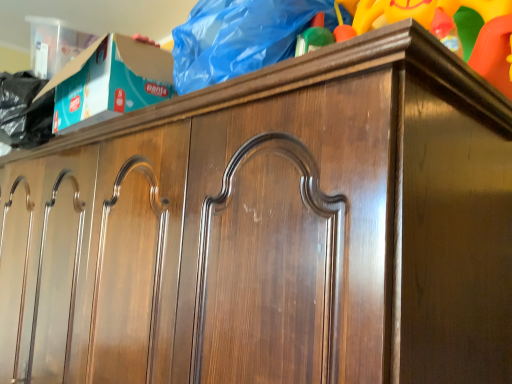
Question: Looking at their shapes, would you say wooden toy at upper right is wider or thinner than wooden cabinet at upper center?

Choices:
 (A) wide
 (B) thin

Answer: (B)

Question: Relative to wooden cabinet at upper center, is wooden toy at upper right in front or behind?

Choices:
 (A) front
 (B) behind

Answer: (A)

Question: From the image's perspective, is wooden toy at upper right located above or below wooden cabinet at upper center?

Choices:
 (A) below
 (B) above

Answer: (B)

Question: From the image's perspective, is wooden cabinet at upper center positioned above or below wooden toy at upper right?

Choices:
 (A) below
 (B) above

Answer: (A)

Question: Is wooden cabinet at upper center bigger or smaller than wooden toy at upper right?

Choices:
 (A) small
 (B) big

Answer: (B)

Question: Visually, is wooden cabinet at upper center positioned to the left or to the right of wooden toy at upper right?

Choices:
 (A) left
 (B) right

Answer: (A)

Question: From a real-world perspective, is wooden cabinet at upper center above or below wooden toy at upper right?

Choices:
 (A) above
 (B) below

Answer: (B)